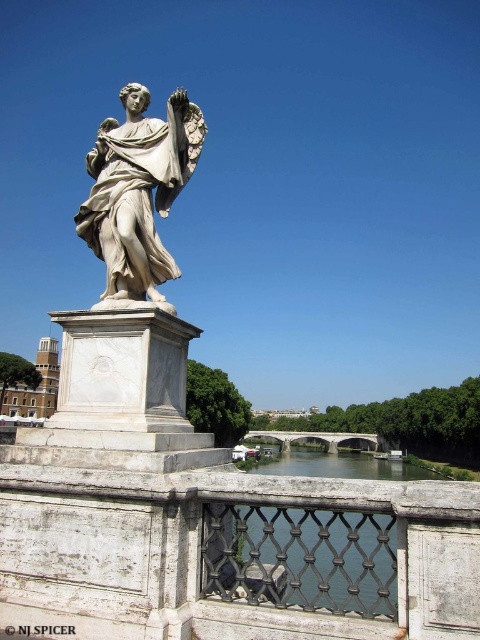
Does clear water at bridge center have a smaller size compared to white stone bridge at center?

Incorrect, clear water at bridge center is not smaller in size than white stone bridge at center.

Who is more forward, [409,472] or [254,432]?

Point [409,472]

Which is in front, point (336, 461) or point (284, 445)?

Positioned in front is point (336, 461).

Where is `clear water at bridge center`? The image size is (480, 640). clear water at bridge center is located at coordinates (335, 465).

Which is behind, point (141, 104) or point (282, 440)?

The point (282, 440) is behind.

Which is below, white marble statue at center or white stone bridge at center?

Positioned lower is white stone bridge at center.

Where is `white marble statue at center`? This screenshot has width=480, height=640. white marble statue at center is located at coordinates (137, 189).

Measure the distance from white marble statue at center to clear water at bridge center.

white marble statue at center is 735.58 feet away from clear water at bridge center.

Between white marble statue at center and clear water at bridge center, which one has more height?

Standing taller between the two is clear water at bridge center.

Which is in front, point (164, 269) or point (316, 460)?

Positioned in front is point (164, 269).

The width and height of the screenshot is (480, 640). I want to click on white marble statue at center, so click(x=137, y=189).